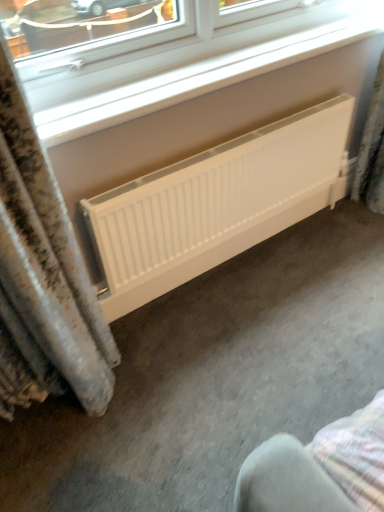
Question: Is white matte radiator at center inside or outside of white plastic window at upper center?

Choices:
 (A) inside
 (B) outside

Answer: (B)

Question: From a real-world perspective, is white matte radiator at center positioned above or below white plastic window at upper center?

Choices:
 (A) above
 (B) below

Answer: (B)

Question: Considering the positions of white matte radiator at center and white plastic window at upper center in the image, is white matte radiator at center taller or shorter than white plastic window at upper center?

Choices:
 (A) short
 (B) tall

Answer: (B)

Question: Is white plastic window at upper center wider or thinner than white matte radiator at center?

Choices:
 (A) thin
 (B) wide

Answer: (B)

Question: In terms of height, does white plastic window at upper center look taller or shorter compared to white matte radiator at center?

Choices:
 (A) tall
 (B) short

Answer: (B)

Question: From the image's perspective, is white plastic window at upper center above or below white matte radiator at center?

Choices:
 (A) below
 (B) above

Answer: (B)

Question: Is white plastic window at upper center bigger or smaller than white matte radiator at center?

Choices:
 (A) big
 (B) small

Answer: (B)